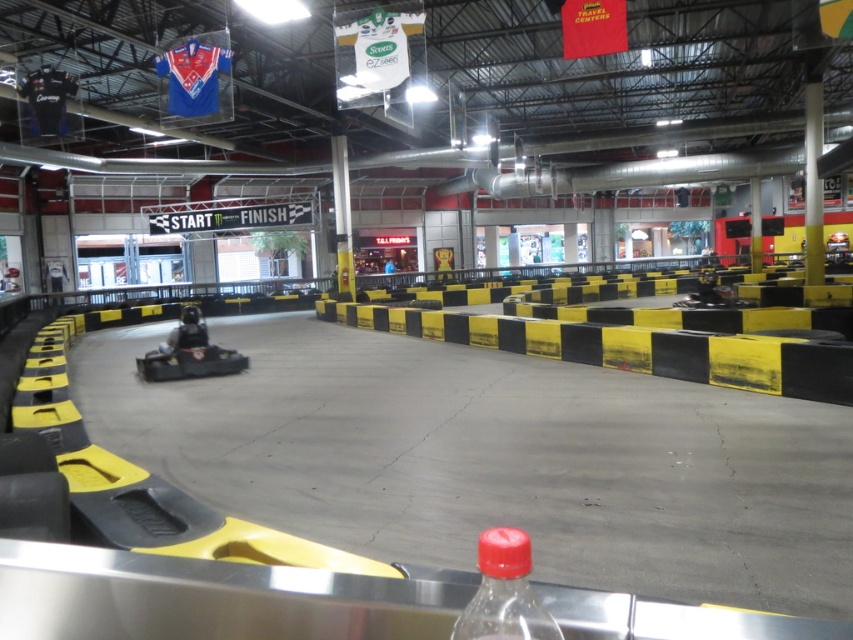
Is point (436, 330) in front of point (485, 531)?

That is False.

In the scene shown: Who is more distant from viewer, (698, 376) or (515, 612)?

The point (698, 376) is more distant.

Find the location of a particular element. The width and height of the screenshot is (853, 640). black/yellow striped barrier at center is located at coordinates (633, 348).